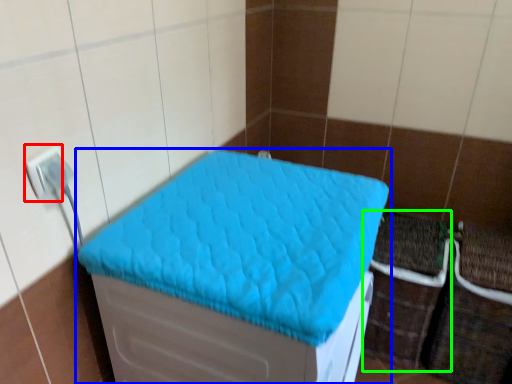
Question: Based on their relative distances, which object is nearer to electric outlet (highlighted by a red box)? Choose from furniture (highlighted by a blue box) and crate (highlighted by a green box).

Choices:
 (A) furniture
 (B) crate

Answer: (A)